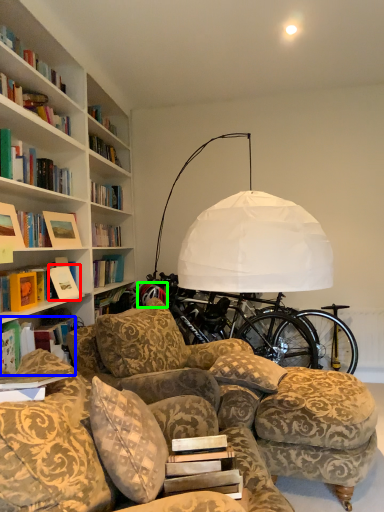
Question: Estimate the real-world distances between objects in this image. Which object is closer to book (highlighted by a red box), book (highlighted by a blue box) or wheel (highlighted by a green box)?

Choices:
 (A) book
 (B) wheel

Answer: (A)